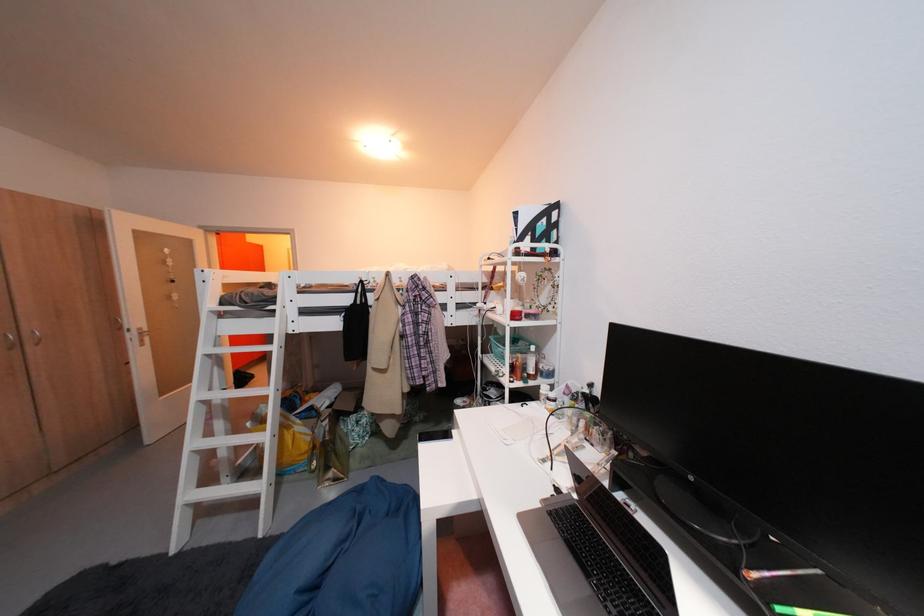
Where would you pull the silver door handle? Please return your answer as a coordinate pair (x, y).

(143, 334)